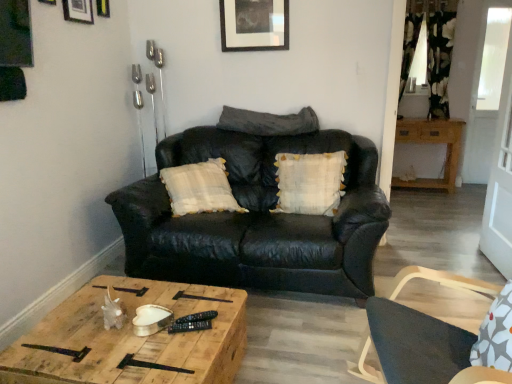
Question: Can you confirm if wooden cabinet at right, placed as the 1th table when sorted from back to front, is wider than metallic silver picture frame at upper center, which appears as the 2th picture frame when viewed from the right?

Choices:
 (A) yes
 (B) no

Answer: (A)

Question: Can you confirm if wooden cabinet at right, the second table positioned from the bottom, is positioned to the left of metallic silver picture frame at upper center, positioned as the 2th picture frame in back-to-front order?

Choices:
 (A) yes
 (B) no

Answer: (B)

Question: From a real-world perspective, is wooden cabinet at right, acting as the 1th table starting from the right, on top of metallic silver picture frame at upper center, acting as the 3th picture frame starting from the left?

Choices:
 (A) yes
 (B) no

Answer: (B)

Question: Is wooden cabinet at right, the 2th table viewed from the left, oriented away from metallic silver picture frame at upper center, which is the third picture frame in front-to-back order?

Choices:
 (A) yes
 (B) no

Answer: (B)

Question: Does wooden cabinet at right, acting as the 1th table starting from the right, have a smaller size compared to metallic silver picture frame at upper center, which is the third picture frame in front-to-back order?

Choices:
 (A) yes
 (B) no

Answer: (B)

Question: From the image's perspective, is brushed metal picture frame at upper left, the fourth picture frame positioned from the right, positioned above or below matte black picture frame at upper center, which is the 4th picture frame in left-to-right order?

Choices:
 (A) below
 (B) above

Answer: (A)

Question: Choose the correct answer: Is brushed metal picture frame at upper left, which is counted as the 4th picture frame, starting from the back, inside matte black picture frame at upper center, marked as the first picture frame in a back-to-front arrangement, or outside it?

Choices:
 (A) inside
 (B) outside

Answer: (B)

Question: Relative to matte black picture frame at upper center, which appears as the first picture frame when viewed from the right, is brushed metal picture frame at upper left, the fourth picture frame positioned from the right, in front or behind?

Choices:
 (A) front
 (B) behind

Answer: (A)

Question: Considering the positions of brushed metal picture frame at upper left, arranged as the 1th picture frame when viewed from the left, and matte black picture frame at upper center, which is the 4th picture frame in left-to-right order, in the image, is brushed metal picture frame at upper left, arranged as the 1th picture frame when viewed from the left, wider or thinner than matte black picture frame at upper center, which is the 4th picture frame in left-to-right order,?

Choices:
 (A) wide
 (B) thin

Answer: (B)

Question: From a real-world perspective, relative to black leather couch at center, is dark gray leather pillow at center, the second pillow from the bottom, vertically above or below?

Choices:
 (A) above
 (B) below

Answer: (A)

Question: In the image, is dark gray leather pillow at center, the second pillow from the bottom, positioned in front of or behind black leather couch at center?

Choices:
 (A) front
 (B) behind

Answer: (B)

Question: From the image's perspective, is dark gray leather pillow at center, the second pillow from the bottom, located above or below black leather couch at center?

Choices:
 (A) above
 (B) below

Answer: (A)

Question: Is dark gray leather pillow at center, placed as the 1th pillow when sorted from top to bottom, wider or thinner than black leather couch at center?

Choices:
 (A) thin
 (B) wide

Answer: (A)

Question: From the image's perspective, is metallic silver picture frame at upper center, which appears as the 2th picture frame when viewed from the right, located above or below matte black picture frame at upper left, which is counted as the 3th picture frame, starting from the right?

Choices:
 (A) below
 (B) above

Answer: (B)

Question: In terms of height, does metallic silver picture frame at upper center, which appears as the 2th picture frame when viewed from the right, look taller or shorter compared to matte black picture frame at upper left, which is counted as the 3th picture frame, starting from the right?

Choices:
 (A) short
 (B) tall

Answer: (A)